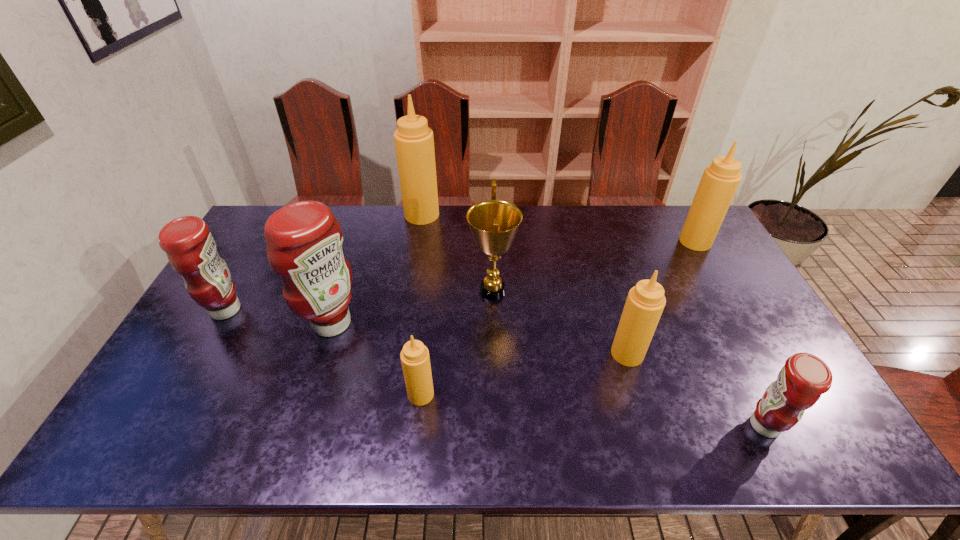
The image size is (960, 540). What are the coordinates of `free region at the near edge of the desktop` in the screenshot? It's located at pyautogui.click(x=379, y=434).

This screenshot has height=540, width=960. In the image, there is a desktop. Find the location of `blank space at the left edge`. blank space at the left edge is located at coordinates (160, 381).

In the image, there is a desktop. At what (x,y) coordinates should I click in order to perform the action: click on free space at the right edge. Please return your answer as a coordinate pair (x, y). Image resolution: width=960 pixels, height=540 pixels. Looking at the image, I should click on (756, 392).

This screenshot has height=540, width=960. Identify the location of vacant point located between the nearest red condiment and the farthest condiment. (593, 320).

You are a GUI agent. You are given a task and a screenshot of the screen. Output one action in this format:
    pyautogui.click(x=<x>, y=<y>)
    Task: Click on the free space that is in between the fifth condiment from left to right and the second smallest red condiment
    
    Given the screenshot: What is the action you would take?
    pyautogui.click(x=426, y=332)

This screenshot has width=960, height=540. In order to click on vacant area that lies between the second farthest object and the nearest tan condiment in this screenshot , I will do `click(558, 318)`.

Find the location of a particular element. This screenshot has height=540, width=960. vacant space in between the leftmost red condiment and the rightmost tan condiment is located at coordinates pyautogui.click(x=461, y=275).

Find the location of a particular element. The image size is (960, 540). vacant space in between the third biggest tan condiment and the award is located at coordinates (560, 322).

Where is `vacant region between the rightmost tan condiment and the leftmost condiment`? Image resolution: width=960 pixels, height=540 pixels. vacant region between the rightmost tan condiment and the leftmost condiment is located at coordinates click(x=461, y=275).

Where is `free space between the farthest object and the smallest tan condiment`? free space between the farthest object and the smallest tan condiment is located at coordinates (421, 305).